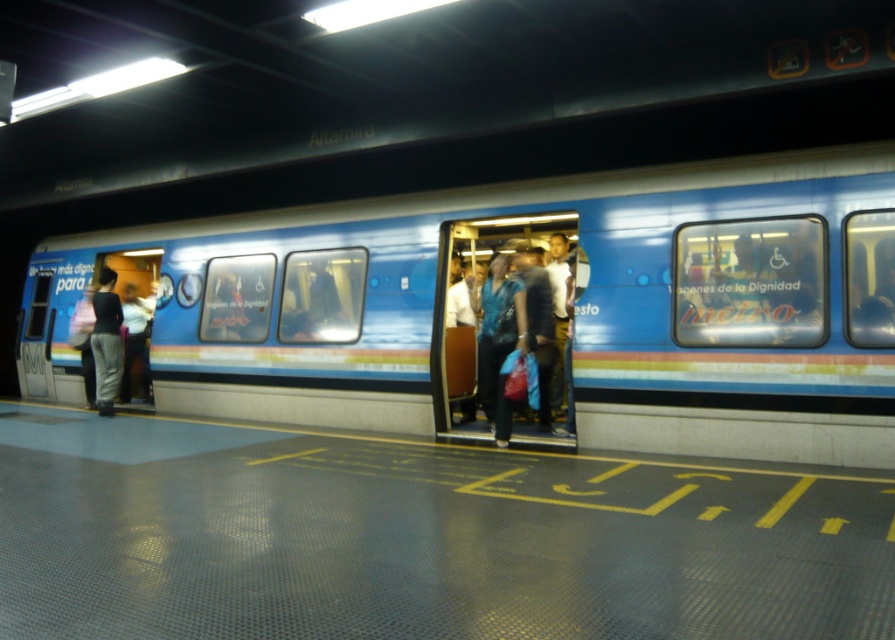
Is point (57, 317) farther from camera compared to point (544, 428)?

Yes, it is behind point (544, 428).

Is blue glossy train at center below blue fabric bag at center?

Correct, blue glossy train at center is located below blue fabric bag at center.

Find the location of a particular element. The height and width of the screenshot is (640, 895). blue glossy train at center is located at coordinates (497, 312).

Does blue glossy train at center appear under black matte pants at left?

No.

Is blue glossy train at center bigger than black matte pants at left?

Yes.

Where is `blue glossy train at center`? This screenshot has height=640, width=895. blue glossy train at center is located at coordinates (497, 312).

Can you confirm if blue fabric bag at center is bigger than black matte pants at left?

Correct, blue fabric bag at center is larger in size than black matte pants at left.

Does blue fabric bag at center have a greater height compared to black matte pants at left?

Indeed, blue fabric bag at center has a greater height compared to black matte pants at left.

Identify the location of blue fabric bag at center. (501, 321).